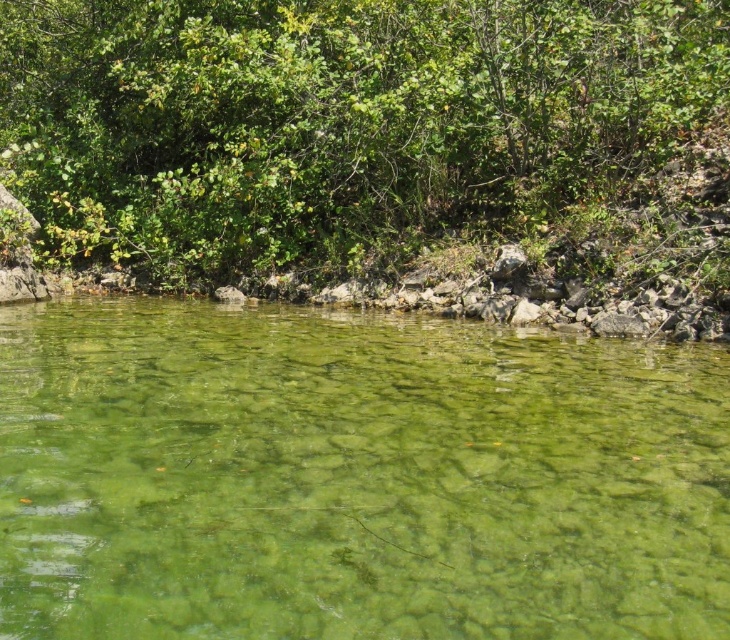
Question: Which point is closer to the camera?

Choices:
 (A) clear water at center
 (B) green leafy bush at upper center

Answer: (A)

Question: Can you confirm if clear water at center is smaller than green leafy bush at upper center?

Choices:
 (A) no
 (B) yes

Answer: (B)

Question: Considering the relative positions of clear water at center and green leafy bush at upper center in the image provided, where is clear water at center located with respect to green leafy bush at upper center?

Choices:
 (A) above
 (B) below

Answer: (B)

Question: In this image, where is clear water at center located relative to green leafy bush at upper center?

Choices:
 (A) above
 (B) below

Answer: (B)

Question: Which of the following is the closest to the observer?

Choices:
 (A) green leafy bush at upper center
 (B) clear water at center

Answer: (B)